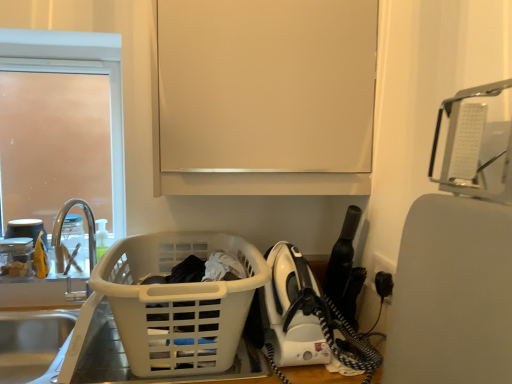
Question: Is frosted glass door at upper left in front of or behind clear glass faucet at left in the image?

Choices:
 (A) behind
 (B) front

Answer: (A)

Question: In terms of size, does frosted glass door at upper left appear bigger or smaller than clear glass faucet at left?

Choices:
 (A) big
 (B) small

Answer: (A)

Question: Which object is positioned farthest from the matte white cabinet at upper center?

Choices:
 (A) frosted glass door at upper left
 (B) clear glass faucet at left
 (C) white plastic laundry basket at lower left
 (D) silver metallic sink at lower left, which ranks as the first sink in bottom-to-top order
 (E) translucent plastic bottle at sink left

Answer: (D)

Question: Considering the real-world distances, which object is farthest from the translucent plastic bottle at sink left?

Choices:
 (A) clear glass faucet at left
 (B) brushed metal sink at left, the 1th sink when ordered from top to bottom
 (C) white plastic iron at lower right
 (D) silver metallic sink at lower left, arranged as the 2th sink when viewed from the top
 (E) white plastic laundry basket at lower left

Answer: (C)